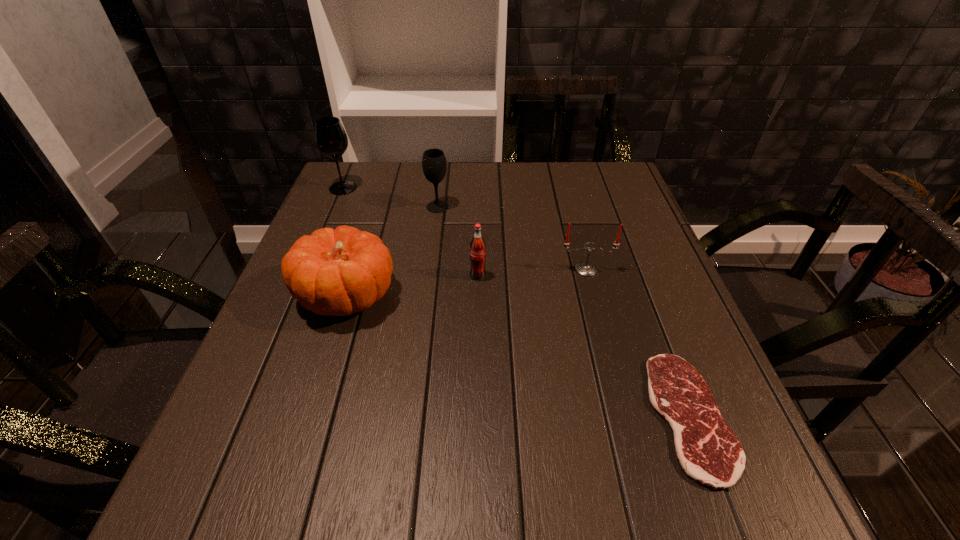
The image size is (960, 540). What are the coordinates of `the taller wineglass` in the screenshot? It's located at (331, 139).

The height and width of the screenshot is (540, 960). I want to click on the tallest object, so click(x=331, y=139).

Locate an element on the screen. The width and height of the screenshot is (960, 540). the fifth nearest object is located at coordinates (434, 164).

Identify the location of the shorter wineglass. (434, 164).

What are the coordinates of `pumpkin` in the screenshot? It's located at (339, 272).

Where is `soda bottle`? Image resolution: width=960 pixels, height=540 pixels. soda bottle is located at coordinates (477, 245).

Where is `candle`? candle is located at coordinates (585, 268).

You are a GUI agent. You are given a task and a screenshot of the screen. Output one action in this format:
    pyautogui.click(x=<x>, y=<y>)
    Task: Click on the shortest object
    This screenshot has height=540, width=960.
    Given the screenshot: What is the action you would take?
    pyautogui.click(x=708, y=451)

Locate an element on the screen. steak is located at coordinates (708, 451).

Where is `vacant space positioned on the right of the farthest object`? The image size is (960, 540). vacant space positioned on the right of the farthest object is located at coordinates (429, 188).